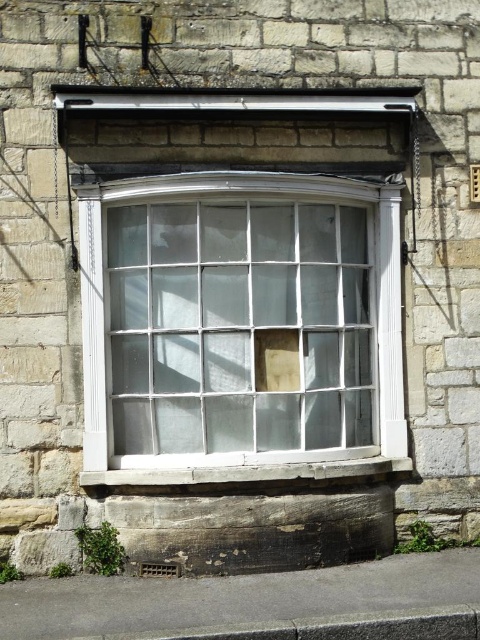
Does clear glass window at center have a lesser height compared to smooth stone window sill at center?

No.

Is clear glass window at center wider than smooth stone window sill at center?

Correct, the width of clear glass window at center exceeds that of smooth stone window sill at center.

Looking at this image, who is more distant from viewer, (228, 426) or (302, 464)?

Positioned behind is point (228, 426).

This screenshot has height=640, width=480. Identify the location of clear glass window at center. (240, 326).